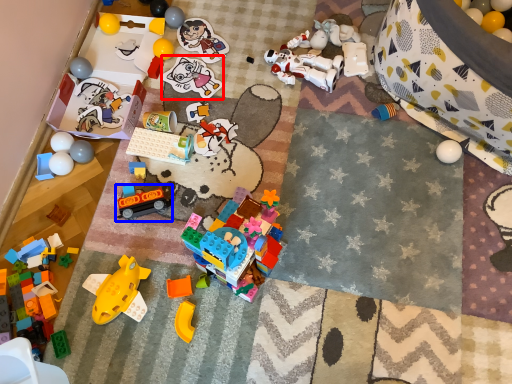
Question: Among these objects, which one is farthest to the camera, toy (highlighted by a red box) or toy (highlighted by a blue box)?

Choices:
 (A) toy
 (B) toy

Answer: (A)